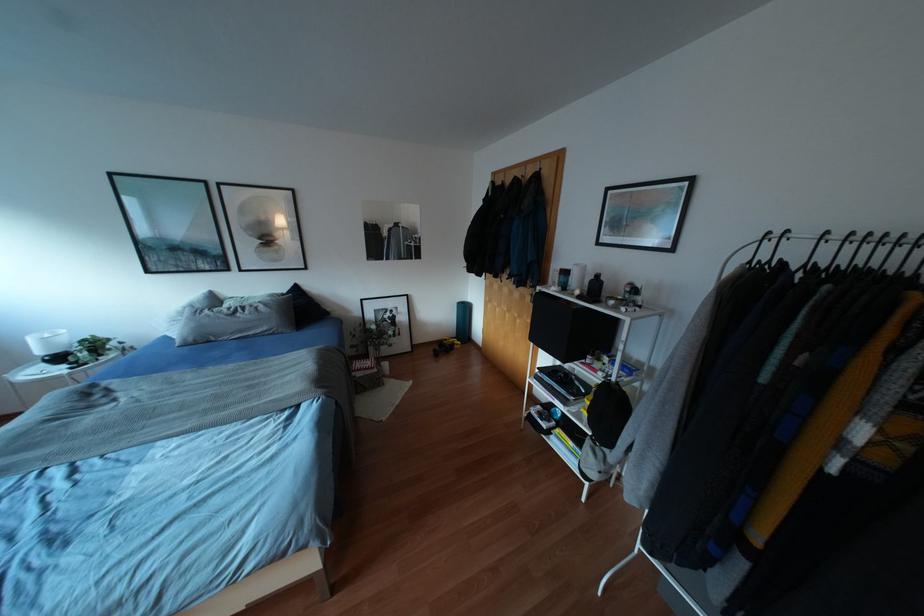
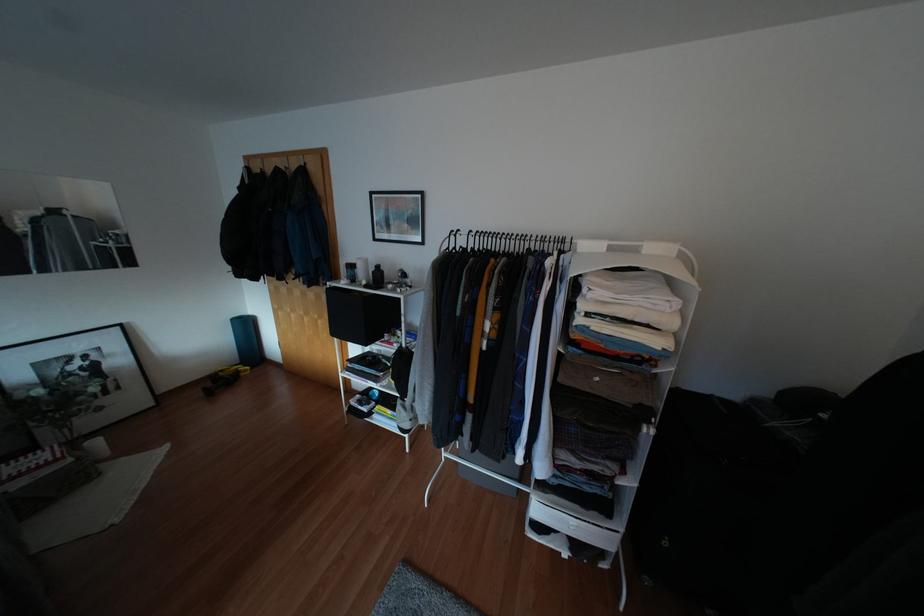
Locate, in the second image, the point that corresponds to point 599,382 in the first image.

(394, 351)